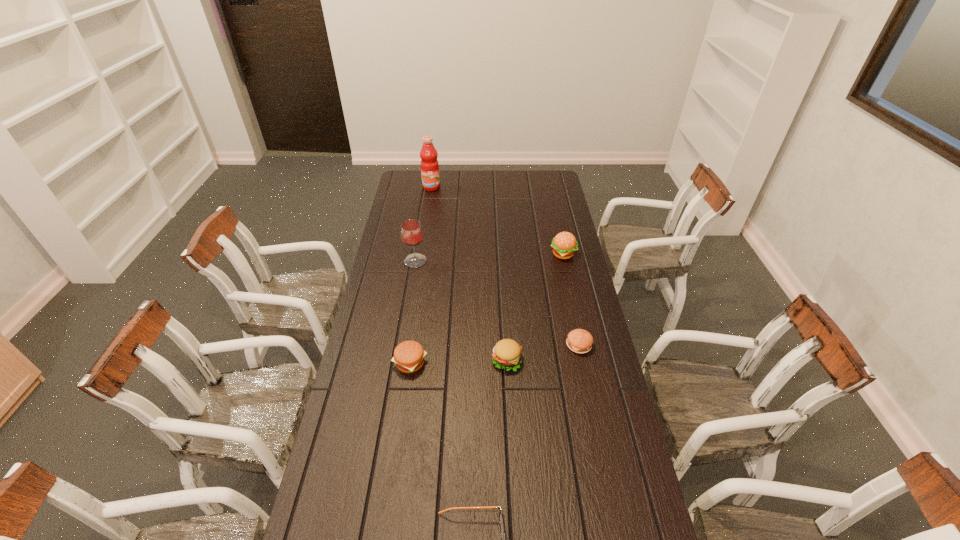
Identify the location of the farthest object. This screenshot has width=960, height=540. click(429, 164).

This screenshot has width=960, height=540. Identify the location of the tallest object. (429, 164).

Where is `the sixth shortest object`? the sixth shortest object is located at coordinates (411, 232).

Locate an element on the screen. This screenshot has width=960, height=540. the farthest hamburger is located at coordinates (564, 244).

Where is `the fifth shortest object`? the fifth shortest object is located at coordinates (564, 244).

Locate an element on the screen. the second hamburger from left to right is located at coordinates (507, 353).

Where is `the leftmost hamburger`? The image size is (960, 540). the leftmost hamburger is located at coordinates (409, 356).

Locate an element on the screen. Image resolution: width=960 pixels, height=540 pixels. the shortest hamburger is located at coordinates (580, 341).

Find the location of `blank space located 0.290m on the front label of the tallest object`. blank space located 0.290m on the front label of the tallest object is located at coordinates (426, 222).

Where is `free space located 0.290m on the back of the sixth shortest object`? free space located 0.290m on the back of the sixth shortest object is located at coordinates (422, 217).